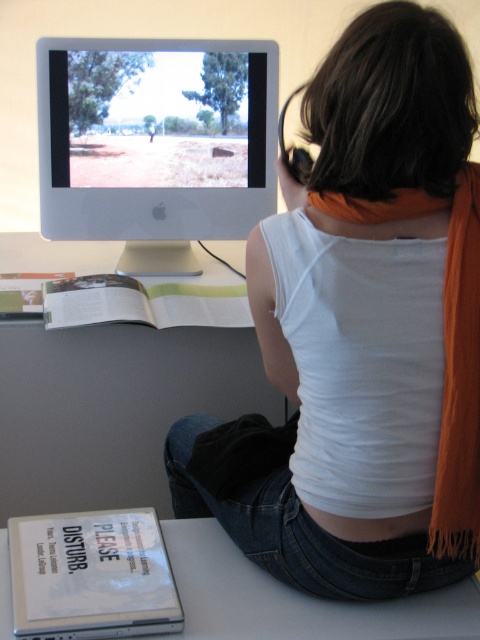
Question: Which point is closer to the camera taking this photo?

Choices:
 (A) (32, 628)
 (B) (442, 260)
 (C) (196, 625)
 (D) (454, 301)

Answer: (A)

Question: Which of these objects is positioned farthest from the white paper at lower left?

Choices:
 (A) orange fringed scarf at back
 (B) white glossy computer monitor at upper center

Answer: (B)

Question: Which point appears closest to the camera in this image?

Choices:
 (A) click(x=112, y=202)
 (B) click(x=416, y=612)
 (C) click(x=432, y=500)

Answer: (C)

Question: Can you confirm if white matte tank top at center is positioned to the left of white glossy computer monitor at upper center?

Choices:
 (A) yes
 (B) no

Answer: (B)

Question: Can you confirm if white paper at lower left is thinner than orange fringed scarf at back?

Choices:
 (A) no
 (B) yes

Answer: (A)

Question: Can you confirm if white matte tank top at center is positioned to the right of orange fringed scarf at back?

Choices:
 (A) no
 (B) yes

Answer: (A)